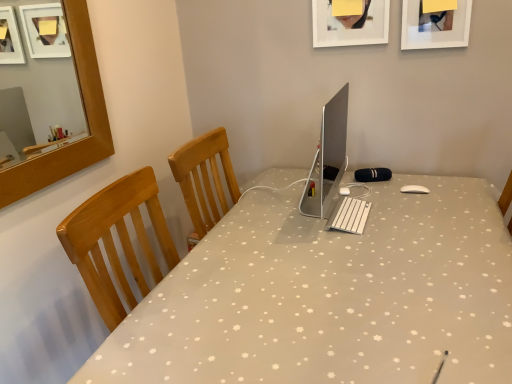
Question: From a real-world perspective, does white matte picture frame at upper right, the 2th picture frame positioned from the left, stand above white fabric desk at center?

Choices:
 (A) yes
 (B) no

Answer: (A)

Question: Can you confirm if white matte picture frame at upper right, the first picture frame in the right-to-left sequence, is bigger than white fabric desk at center?

Choices:
 (A) yes
 (B) no

Answer: (B)

Question: From the image's perspective, would you say white matte picture frame at upper right, the first picture frame in the right-to-left sequence, is shown under white fabric desk at center?

Choices:
 (A) yes
 (B) no

Answer: (B)

Question: From the image's perspective, is white matte picture frame at upper right, the 2th picture frame positioned from the left, over white fabric desk at center?

Choices:
 (A) no
 (B) yes

Answer: (B)

Question: Does point (369, 41) appear closer or farther from the camera than point (337, 221)?

Choices:
 (A) farther
 (B) closer

Answer: (A)

Question: Is matte white picture frame at upper center, which is the first picture frame in left-to-right order, spatially inside white plastic keyboard at center, or outside of it?

Choices:
 (A) inside
 (B) outside

Answer: (B)

Question: From a real-world perspective, relative to white plastic keyboard at center, is matte white picture frame at upper center, the 2th picture frame from the right, vertically above or below?

Choices:
 (A) below
 (B) above

Answer: (B)

Question: From the image's perspective, is matte white picture frame at upper center, which is the first picture frame in left-to-right order, positioned above or below white plastic keyboard at center?

Choices:
 (A) above
 (B) below

Answer: (A)

Question: Is point pyautogui.click(x=327, y=158) closer or farther from the camera than point pyautogui.click(x=374, y=183)?

Choices:
 (A) closer
 (B) farther

Answer: (A)

Question: Looking at their shapes, would you say silver metallic computer monitor at center is wider or thinner than white fabric desk at center?

Choices:
 (A) wide
 (B) thin

Answer: (B)

Question: From the image's perspective, is silver metallic computer monitor at center located above or below white fabric desk at center?

Choices:
 (A) below
 (B) above

Answer: (B)

Question: Is silver metallic computer monitor at center taller or shorter than white fabric desk at center?

Choices:
 (A) tall
 (B) short

Answer: (B)

Question: Is white fabric desk at center wider or thinner than matte white picture frame at upper center, the 2th picture frame from the right?

Choices:
 (A) wide
 (B) thin

Answer: (A)

Question: From the image's perspective, is white fabric desk at center positioned above or below matte white picture frame at upper center, the 2th picture frame from the right?

Choices:
 (A) below
 (B) above

Answer: (A)